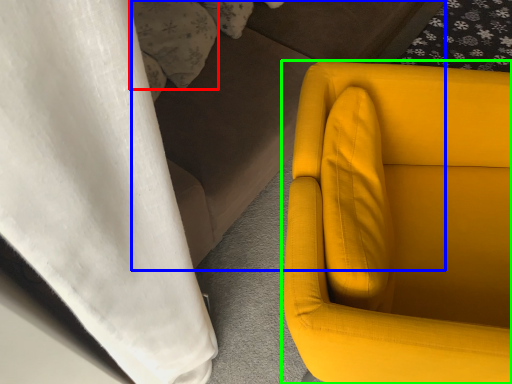
Question: Considering the real-world distances, which object is farthest from pillow (highlighted by a red box)? couch (highlighted by a blue box) or chair (highlighted by a green box)?

Choices:
 (A) couch
 (B) chair

Answer: (B)